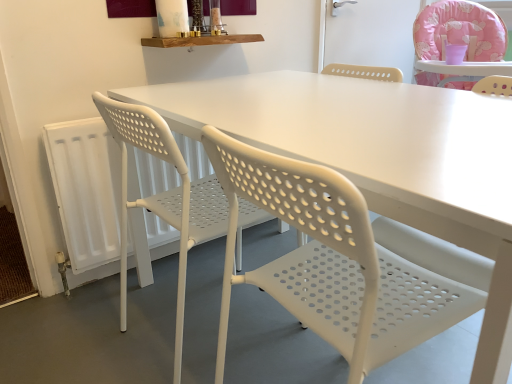
Identify the location of vacant space to the left of white perforated plastic chair at left, the third chair positioned from the right. This screenshot has height=384, width=512. (86, 332).